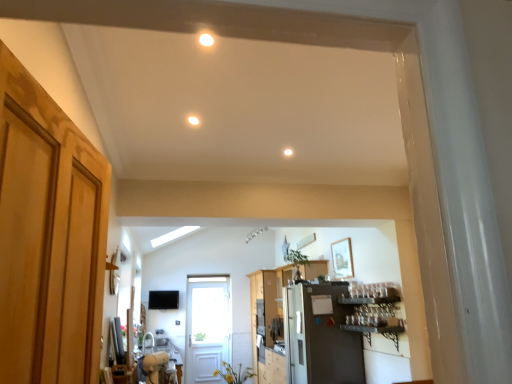
Where is `free space between white glossy light fixture at upper center, the third lighting ordered from the bottom, and matte white light fixture at center, which ranks as the second lighting in back-to-front order`? free space between white glossy light fixture at upper center, the third lighting ordered from the bottom, and matte white light fixture at center, which ranks as the second lighting in back-to-front order is located at coordinates (201, 79).